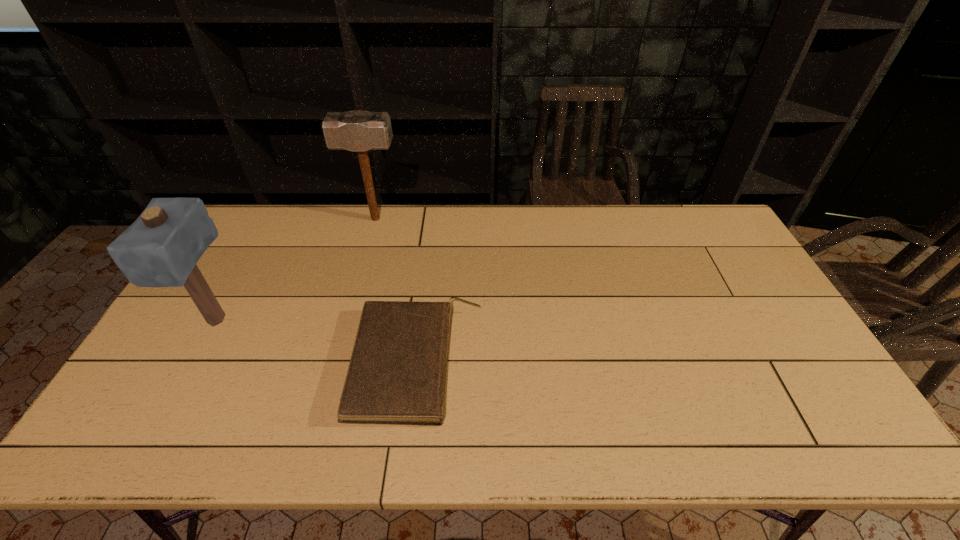
I want to click on object located at the left edge, so click(x=161, y=248).

You are a GUI agent. You are given a task and a screenshot of the screen. Output one action in this format:
    pyautogui.click(x=<x>, y=<y>)
    Task: Click on the free space at the far edge of the desktop
    This screenshot has width=960, height=540.
    Given the screenshot: What is the action you would take?
    pyautogui.click(x=577, y=210)

Locate an element on the screen. vacant space at the near edge is located at coordinates (466, 435).

The height and width of the screenshot is (540, 960). In the image, there is a desktop. In order to click on vacant space at the left edge in this screenshot , I will do click(262, 264).

I want to click on vacant space at the right edge of the desktop, so click(x=756, y=313).

Identify the location of vacant space that's between the right mallet and the nearer mallet. (296, 270).

Find the location of `empty location between the farthest object and the nearer mallet`. empty location between the farthest object and the nearer mallet is located at coordinates (296, 270).

Identify the location of vacant space that's between the leftmost object and the paperback book. This screenshot has height=540, width=960. (317, 342).

Where is `free point between the paperback book and the leftmost object`? free point between the paperback book and the leftmost object is located at coordinates (317, 342).

This screenshot has width=960, height=540. Find the location of `vacant space that is in between the farther mallet and the nearer mallet`. vacant space that is in between the farther mallet and the nearer mallet is located at coordinates (296, 270).